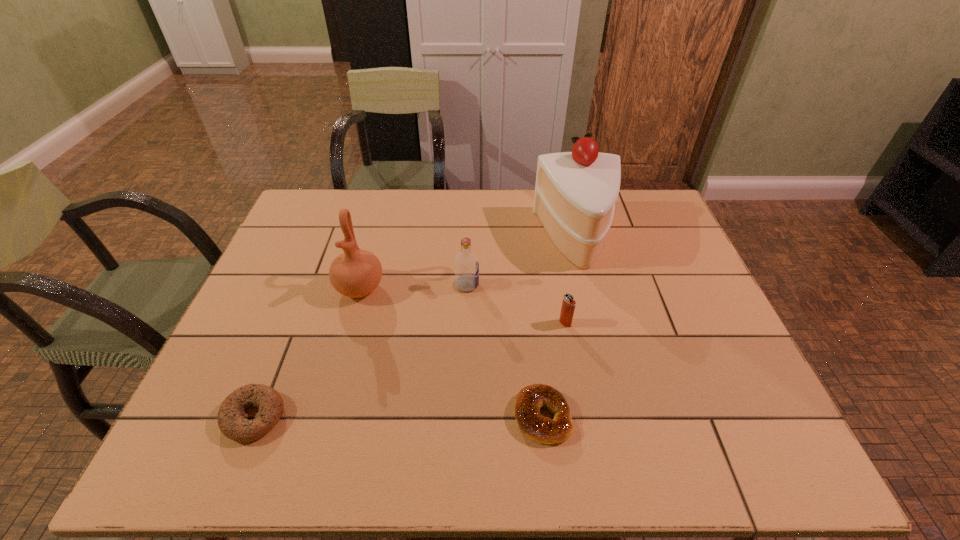
Image resolution: width=960 pixels, height=540 pixels. I want to click on the tallest object, so click(575, 192).

In order to click on the second object from left to right in this screenshot , I will do `click(356, 273)`.

I want to click on the second tallest object, so click(356, 273).

The image size is (960, 540). In order to click on the third object from left to right in this screenshot , I will do `click(466, 262)`.

Identify the location of the third tallest object. The height and width of the screenshot is (540, 960). (466, 262).

Where is `the third nearest object`? the third nearest object is located at coordinates (568, 305).

At what (x,y) coordinates should I click in order to perform the action: click on igniter. Please return your answer as a coordinate pair (x, y). Looking at the image, I should click on (568, 305).

At what (x,y) coordinates should I click in order to perform the action: click on the leftmost object. Please return your answer as a coordinate pair (x, y). This screenshot has width=960, height=540. Looking at the image, I should click on point(231,416).

You are a GUI agent. You are given a task and a screenshot of the screen. Output one action in this format:
    pyautogui.click(x=<x>, y=<y>)
    Task: Click on the right bagel
    This screenshot has height=540, width=960.
    Given the screenshot: What is the action you would take?
    pyautogui.click(x=530, y=399)

Locate an element on the screen. blank area located on the left of the cake is located at coordinates (453, 239).